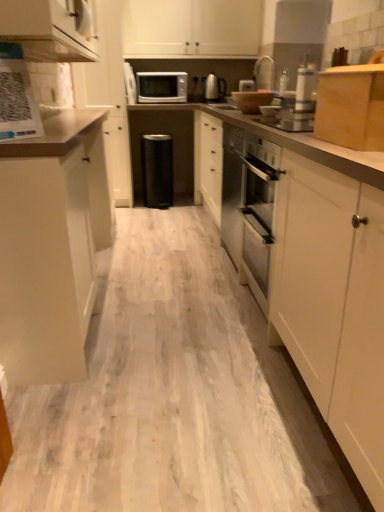
Question: Is there a large distance between black matte dishwasher at center and white matte cabinet at upper left, which appears as the fifth cabinetry when viewed from the right?

Choices:
 (A) yes
 (B) no

Answer: (B)

Question: Considering the relative sizes of black matte dishwasher at center and white matte cabinet at upper left, positioned as the first cabinetry in left-to-right order, in the image provided, is black matte dishwasher at center shorter than white matte cabinet at upper left, positioned as the first cabinetry in left-to-right order,?

Choices:
 (A) yes
 (B) no

Answer: (A)

Question: Is black matte dishwasher at center thinner than white matte cabinet at upper left, which appears as the fifth cabinetry when viewed from the right?

Choices:
 (A) yes
 (B) no

Answer: (A)

Question: Considering the relative positions of black matte dishwasher at center and white matte cabinet at upper left, which appears as the fifth cabinetry when viewed from the right, in the image provided, is black matte dishwasher at center to the right of white matte cabinet at upper left, which appears as the fifth cabinetry when viewed from the right, from the viewer's perspective?

Choices:
 (A) yes
 (B) no

Answer: (A)

Question: From the image's perspective, would you say black matte dishwasher at center is shown under white matte cabinet at upper left, which appears as the fifth cabinetry when viewed from the right?

Choices:
 (A) yes
 (B) no

Answer: (A)

Question: Is black matte dishwasher at center turned away from white matte cabinet at upper left, positioned as the first cabinetry in left-to-right order?

Choices:
 (A) no
 (B) yes

Answer: (A)

Question: Are matte white cabinet at left, acting as the third cabinetry starting from the right, and white matte cabinet at upper left, which appears as the fifth cabinetry when viewed from the right, far apart?

Choices:
 (A) yes
 (B) no

Answer: (A)

Question: Considering the relative sizes of matte white cabinet at left, which appears as the 3th cabinetry when viewed from the left, and white matte cabinet at upper left, positioned as the first cabinetry in left-to-right order, in the image provided, is matte white cabinet at left, which appears as the 3th cabinetry when viewed from the left, shorter than white matte cabinet at upper left, positioned as the first cabinetry in left-to-right order,?

Choices:
 (A) yes
 (B) no

Answer: (A)

Question: Is the position of matte white cabinet at left, which appears as the 3th cabinetry when viewed from the left, less distant than that of white matte cabinet at upper left, positioned as the first cabinetry in left-to-right order?

Choices:
 (A) no
 (B) yes

Answer: (B)

Question: Is matte white cabinet at left, acting as the third cabinetry starting from the right, further to camera compared to white matte cabinet at upper left, positioned as the first cabinetry in left-to-right order?

Choices:
 (A) no
 (B) yes

Answer: (A)

Question: Is matte white cabinet at left, which appears as the 3th cabinetry when viewed from the left, thinner than white matte cabinet at upper left, positioned as the first cabinetry in left-to-right order?

Choices:
 (A) yes
 (B) no

Answer: (A)

Question: Does matte white cabinet at left, which appears as the 3th cabinetry when viewed from the left, appear on the left side of white matte cabinet at upper left, which appears as the fifth cabinetry when viewed from the right?

Choices:
 (A) yes
 (B) no

Answer: (B)

Question: From the image's perspective, would you say wooden box at upper right, the 5th cabinetry when ordered from left to right, is positioned over matte white cabinet at left, which appears as the 3th cabinetry when viewed from the left?

Choices:
 (A) yes
 (B) no

Answer: (A)